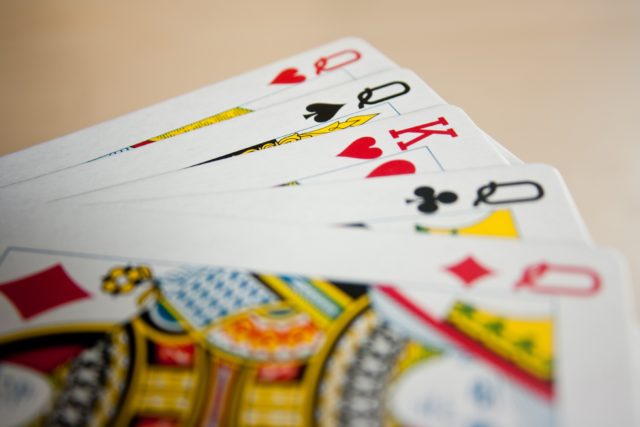
This screenshot has width=640, height=427. I want to click on floor, so click(557, 110).